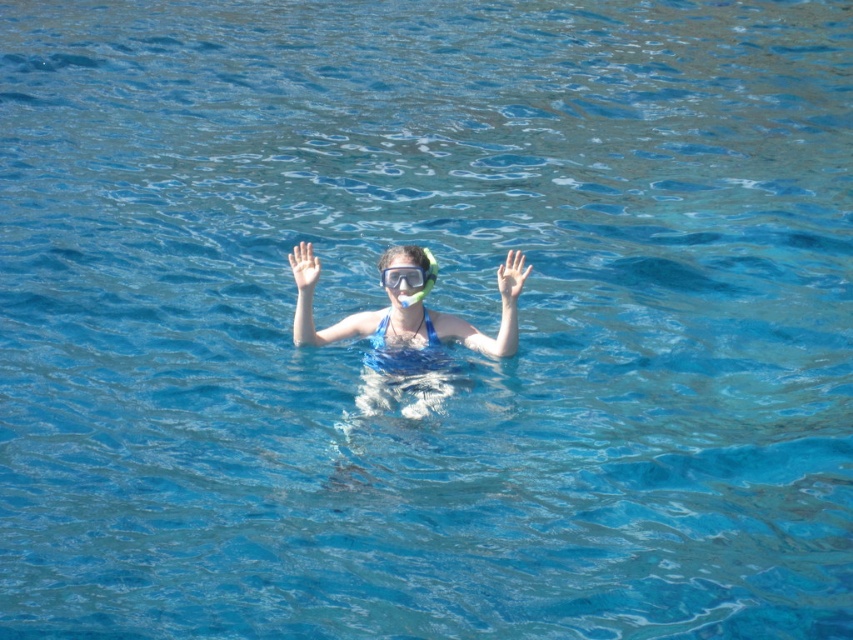
You are a lifeguard on duty and notice a swimmer in the water. You have to determine if their swimsuit is large enough to cover their goggles. Based on the image, does the matte blue swimsuit at center cover the clear plastic goggles at center?

The matte blue swimsuit at center has a larger size compared to clear plastic goggles at center, so yes, the swimsuit is large enough to cover the goggles.

From the picture: You are a lifeguard standing at the camera position. A swimmer is at point [506,296]. Your rescue buoy is 15 meters away from you. Can you reach the swimmer with the rescue buoy?

The point [506,296] is 14.86 meters from the camera, so yes, the rescue buoy can reach the swimmer because it is within the 15 meters range.

You are a lifeguard on duty and notice a swimmer in the water. You see the transparent rubber hand at center and the clear plastic goggles at center. Which object is located to the right of the other?

The transparent rubber hand at center is positioned on the right side of clear plastic goggles at center.